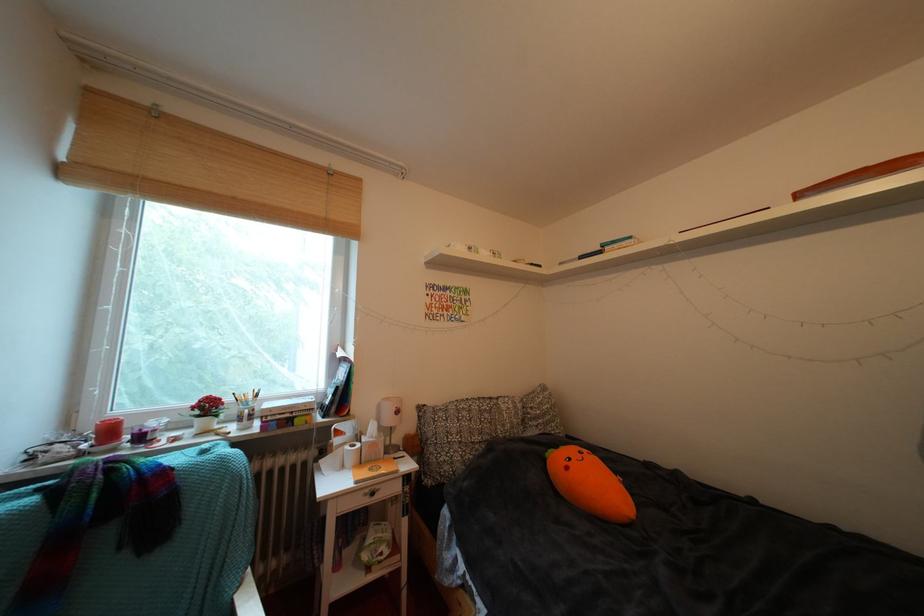
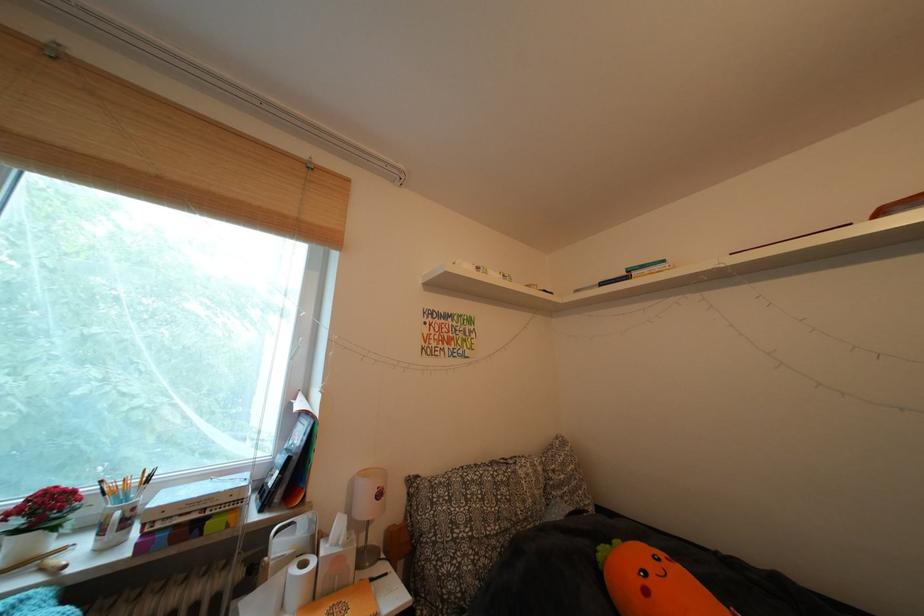
In the second image, find the point that corresponds to (578,472) in the first image.

(657, 597)